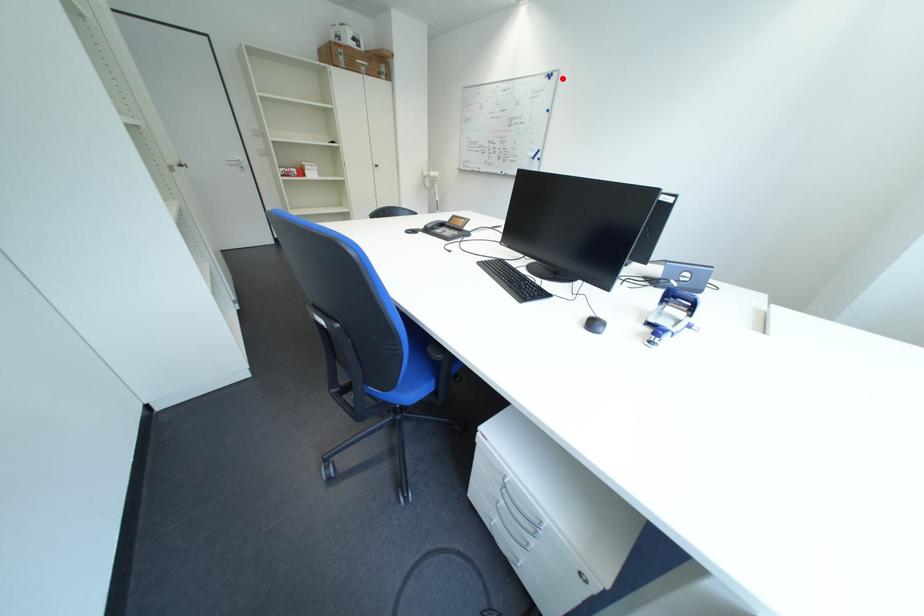
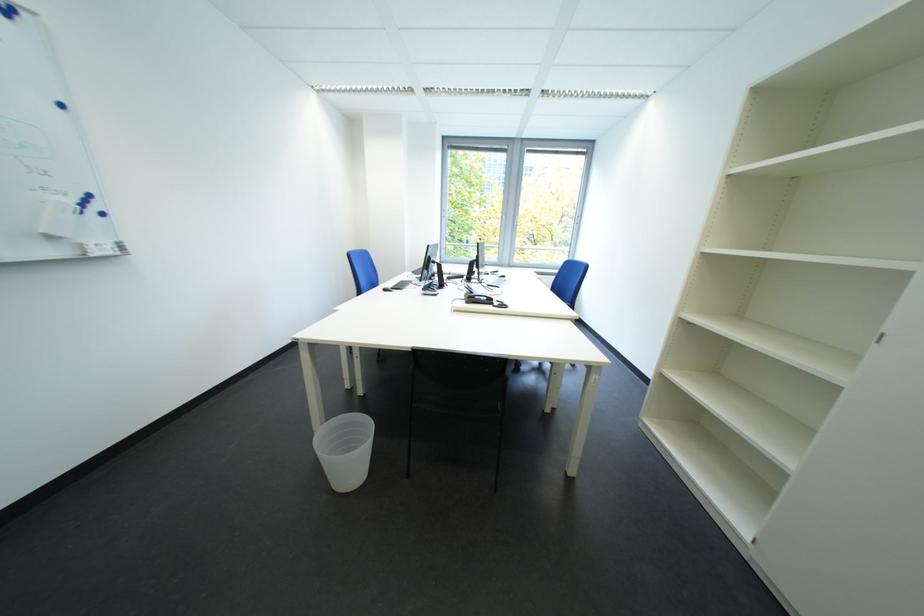
Question: A red point is marked in image1. In image2, is the corresponding 3D point closer to the camera or farther? Reply with the corresponding letter.

Choices:
 (A) The corresponding 3D point is closer.
 (B) The corresponding 3D point is farther.

Answer: (B)